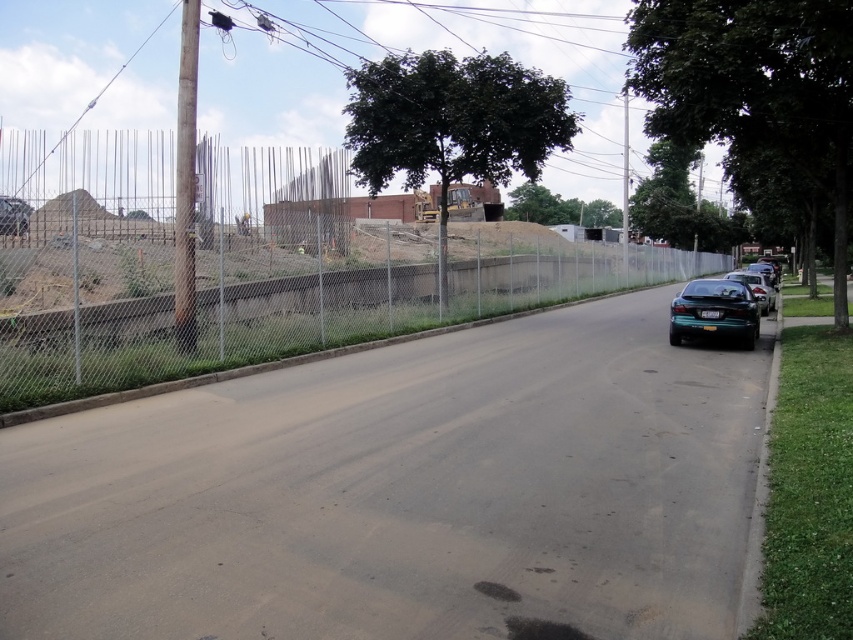
You are standing at the point with coordinates [265,264] in the image. What object are you facing?

The point at coordinates [265,264] corresponds to the chainlink fence at center, so you are facing the chainlink fence at center.

You are a delivery person who needs to place a 100 foot long delivery truck between the metallic wire at upper center and the teal glossy sedan at right. Is there enough space to fit the truck without moving either object?

The metallic wire at upper center and the teal glossy sedan at right are 112.96 feet apart from each other. Since the delivery truck is 100 feet long, there is enough space to fit it between them as the distance between the two objects is greater than the truck length.

You are a delivery person trying to navigate through the street. There is a metallic wire at upper center and a teal glossy sedan at right. Which object is taller from your perspective?

The metallic wire at upper center is much taller than the teal glossy sedan at right from your perspective.